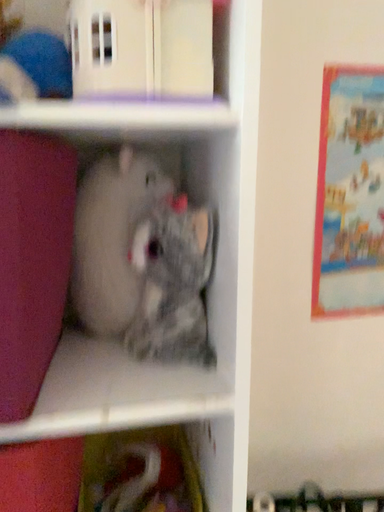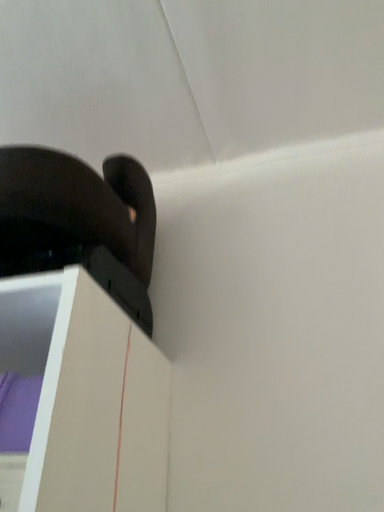
Question: Which way did the camera rotate in the video?

Choices:
 (A) rotated left
 (B) rotated right

Answer: (A)